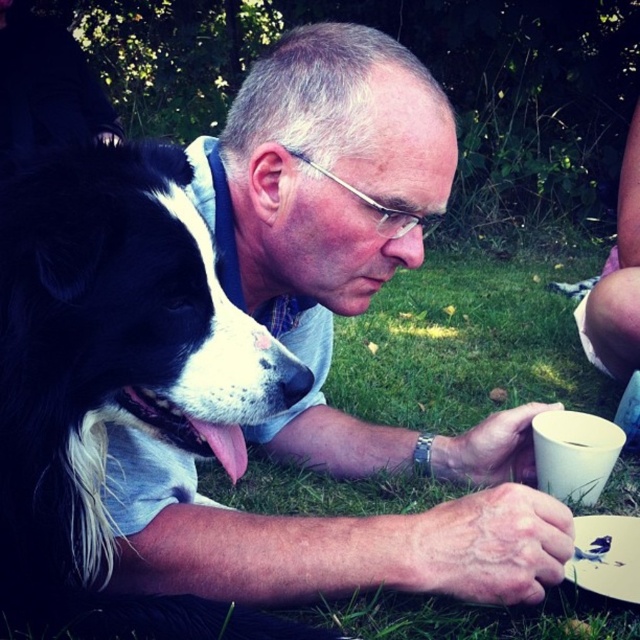
Question: Does matte white shirt at center appear under black fur dog at center?

Choices:
 (A) no
 (B) yes

Answer: (A)

Question: Which object is closer to the camera taking this photo?

Choices:
 (A) white matte cup at lower right
 (B) matte white shirt at center

Answer: (B)

Question: Can you confirm if matte white shirt at center is positioned to the right of white matte cup at lower right?

Choices:
 (A) no
 (B) yes

Answer: (A)

Question: Does matte white shirt at center have a lesser width compared to black fur dog at center?

Choices:
 (A) no
 (B) yes

Answer: (A)

Question: Estimate the real-world distances between objects in this image. Which object is farther from the matte white shirt at center?

Choices:
 (A) white matte cup at lower right
 (B) black fur dog at center

Answer: (A)

Question: Which of the following is the closest to the observer?

Choices:
 (A) (403, 150)
 (B) (600, 422)
 (C) (32, 438)

Answer: (C)